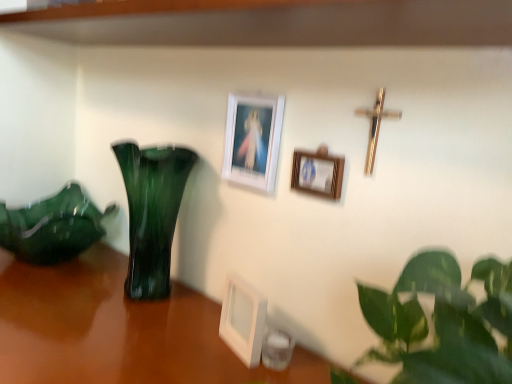
Question: Can you see gold metallic crucifix at upper right touching white plastic picture frame at center, the 1th picture frame ordered from the bottom?

Choices:
 (A) no
 (B) yes

Answer: (A)

Question: Does gold metallic crucifix at upper right have a greater height compared to white plastic picture frame at center, the 1th picture frame ordered from the bottom?

Choices:
 (A) yes
 (B) no

Answer: (A)

Question: Is gold metallic crucifix at upper right positioned far away from white plastic picture frame at center, the 1th picture frame ordered from the bottom?

Choices:
 (A) no
 (B) yes

Answer: (A)

Question: Does gold metallic crucifix at upper right contain white plastic picture frame at center, the 1th picture frame ordered from the bottom?

Choices:
 (A) no
 (B) yes

Answer: (A)

Question: Does gold metallic crucifix at upper right have a smaller size compared to white plastic picture frame at center, placed as the third picture frame when sorted from top to bottom?

Choices:
 (A) no
 (B) yes

Answer: (B)

Question: Can you confirm if gold metallic crucifix at upper right is shorter than white plastic picture frame at center, placed as the third picture frame when sorted from top to bottom?

Choices:
 (A) yes
 (B) no

Answer: (B)

Question: Does white plastic picture frame at center, placed as the third picture frame when sorted from top to bottom, have a larger size compared to gold metallic crucifix at upper right?

Choices:
 (A) yes
 (B) no

Answer: (A)

Question: From the image's perspective, is white plastic picture frame at center, the 1th picture frame ordered from the bottom, on top of gold metallic crucifix at upper right?

Choices:
 (A) no
 (B) yes

Answer: (A)

Question: Would you say white plastic picture frame at center, placed as the third picture frame when sorted from top to bottom, contains gold metallic crucifix at upper right?

Choices:
 (A) no
 (B) yes

Answer: (A)

Question: From a real-world perspective, is white plastic picture frame at center, the 1th picture frame ordered from the bottom, beneath gold metallic crucifix at upper right?

Choices:
 (A) yes
 (B) no

Answer: (A)

Question: Does white plastic picture frame at center, the 1th picture frame ordered from the bottom, lie behind gold metallic crucifix at upper right?

Choices:
 (A) yes
 (B) no

Answer: (A)

Question: Is the position of white plastic picture frame at center, placed as the third picture frame when sorted from top to bottom, less distant than that of gold metallic crucifix at upper right?

Choices:
 (A) yes
 (B) no

Answer: (B)

Question: Is white matte picture frame at upper center, which appears as the 3th picture frame when ordered from the bottom, thinner than gold metallic crucifix at upper right?

Choices:
 (A) yes
 (B) no

Answer: (B)